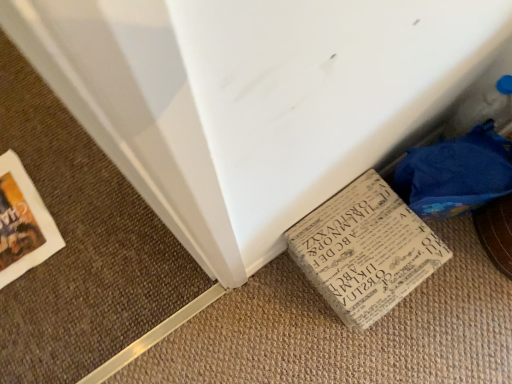
Where is `free space to the left of printed paper book at lower right`? This screenshot has width=512, height=384. free space to the left of printed paper book at lower right is located at coordinates (271, 310).